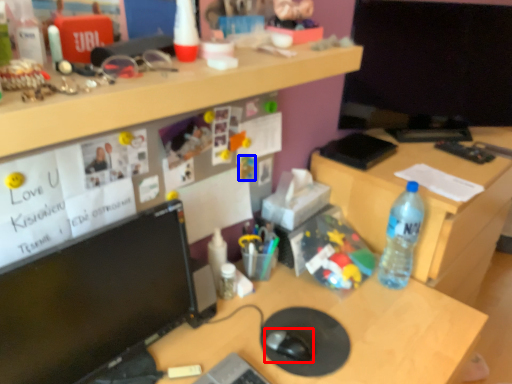
Question: Among these objects, which one is farthest to the camera, mouse (highlighted by a red box) or toy (highlighted by a blue box)?

Choices:
 (A) mouse
 (B) toy

Answer: (B)